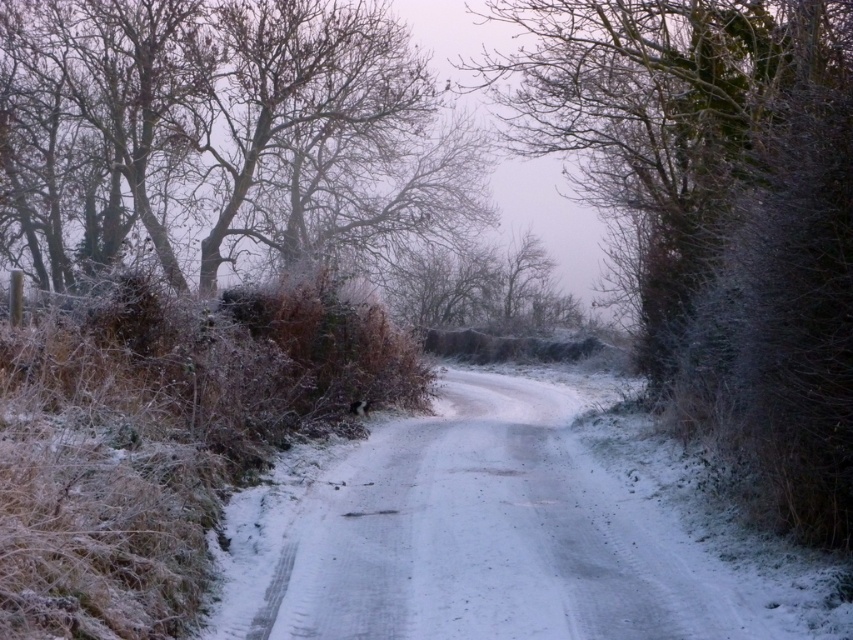
You are standing at the point closer to the viewer in the winter scene. Which point are you at, point (643, 195) or point (231, 83)?

You are at point (643, 195) because it is closer to the viewer than point (231, 83).